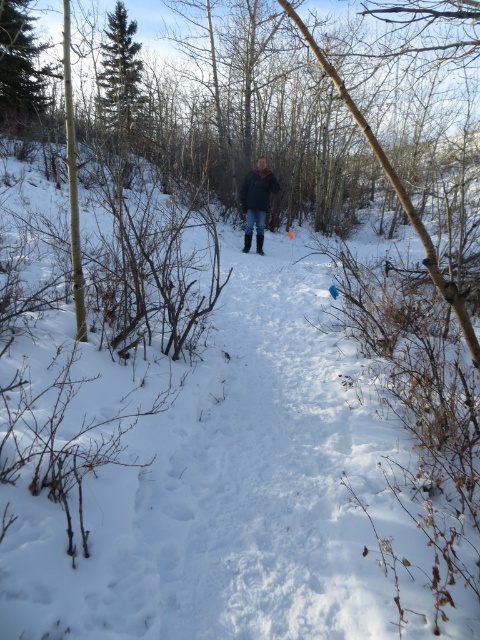
Question: Does green matte tree at upper left appear on the right side of green leafy tree at upper left?

Choices:
 (A) no
 (B) yes

Answer: (B)

Question: Estimate the real-world distances between objects in this image. Which object is closer to the green leafy tree at upper left?

Choices:
 (A) green matte tree at upper left
 (B) dark blue jacket at center

Answer: (A)

Question: Which of these objects is positioned farthest from the dark blue jacket at center?

Choices:
 (A) green matte tree at upper left
 (B) green leafy tree at upper left

Answer: (B)

Question: Does green leafy tree at upper left appear under dark blue jacket at center?

Choices:
 (A) no
 (B) yes

Answer: (A)

Question: Which of the following is the farthest from the observer?

Choices:
 (A) green matte tree at upper left
 (B) green leafy tree at upper left
 (C) dark blue jacket at center

Answer: (A)

Question: Can you confirm if green matte tree at upper left is bigger than green leafy tree at upper left?

Choices:
 (A) no
 (B) yes

Answer: (B)